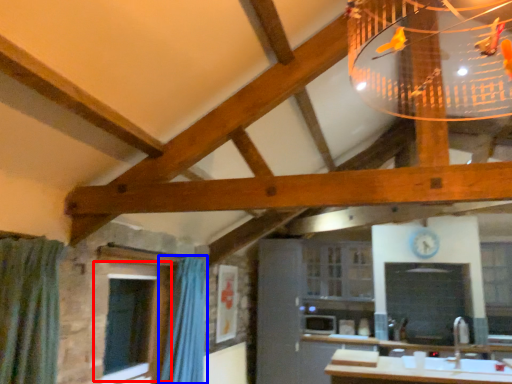
Question: Which of the following is the closest to the observer, window (highlighted by a red box) or shower curtain (highlighted by a blue box)?

Choices:
 (A) window
 (B) shower curtain

Answer: (A)